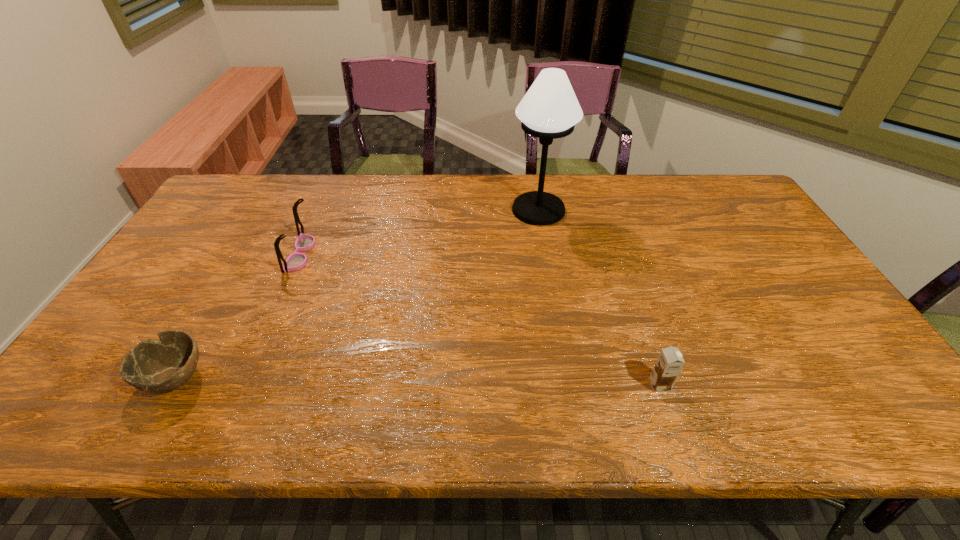
Image resolution: width=960 pixels, height=540 pixels. What are the coordinates of `vacant space located 0.350m on the left of the chocolate milk` in the screenshot? It's located at (496, 385).

Find the location of `free space located on the back of the leftmost object`. free space located on the back of the leftmost object is located at coordinates (250, 249).

In order to click on object that is at the far edge in this screenshot , I will do `click(549, 110)`.

Find the location of a particular element. This screenshot has height=540, width=960. object at the near edge is located at coordinates (155, 366).

This screenshot has width=960, height=540. I want to click on object that is at the left edge, so click(155, 366).

This screenshot has width=960, height=540. I want to click on object present at the near left corner, so click(x=155, y=366).

The image size is (960, 540). Find the location of `free space at the far edge of the desktop`. free space at the far edge of the desktop is located at coordinates (378, 194).

You are a GUI agent. You are given a task and a screenshot of the screen. Output one action in this format:
    pyautogui.click(x=<x>, y=<y>)
    Task: Click on the vacant space at the left edge of the desktop
    
    Given the screenshot: What is the action you would take?
    pyautogui.click(x=190, y=283)

The width and height of the screenshot is (960, 540). What are the coordinates of `vacant space at the right edge of the desktop` in the screenshot? It's located at (751, 217).

Image resolution: width=960 pixels, height=540 pixels. In the image, there is a desktop. In order to click on vacant space at the far left corner in this screenshot , I will do `click(248, 195)`.